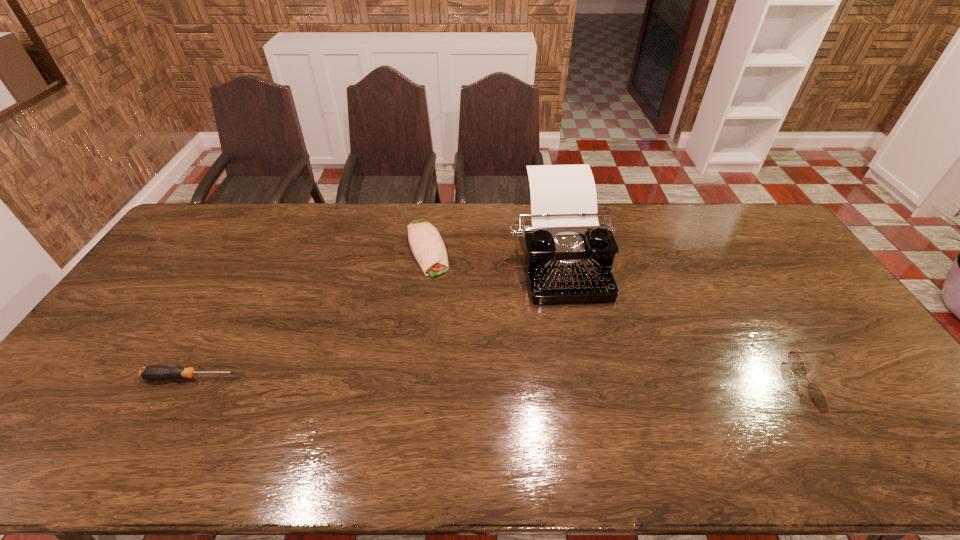
Locate an element on the screen. screwdriver is located at coordinates (153, 372).

Find the location of `sunglasses`. sunglasses is located at coordinates (816, 395).

Identify the location of the second object from left to right. (428, 248).

Locate an element on the screen. the tallest object is located at coordinates click(569, 255).

This screenshot has width=960, height=540. I want to click on the second object from right to left, so click(x=569, y=255).

The image size is (960, 540). Find the location of `free space located at the tip of the leftmost object`. free space located at the tip of the leftmost object is located at coordinates (71, 377).

Find the location of a particular element. Image resolution: width=960 pixels, height=540 pixels. vacant space located at the tip of the leftmost object is located at coordinates (121, 377).

The height and width of the screenshot is (540, 960). In order to click on vacant position located 0.130m at the tip of the leftmost object in this screenshot , I will do `click(94, 377)`.

Image resolution: width=960 pixels, height=540 pixels. Find the location of `free region located on the face of the rightmost object`. free region located on the face of the rightmost object is located at coordinates (712, 387).

Identify the location of vacant space located on the face of the rightmost object. The image size is (960, 540). (658, 387).